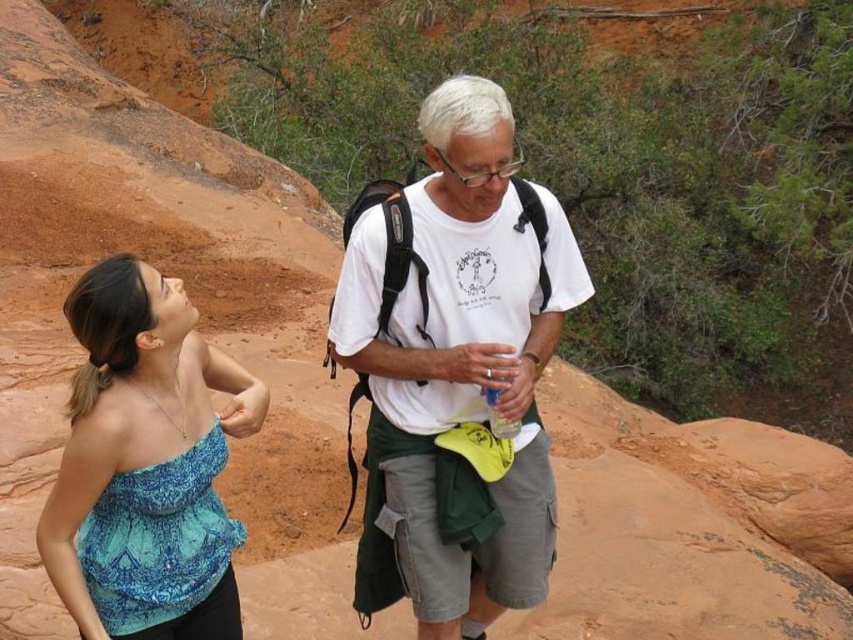
Based on the photo, you are taking a photo of two people standing in a natural setting. You notice two points in the image at coordinates point (430, 404) and point (376, 413). Which point is closer to the camera?

Point (430, 404) is closer to the camera than point (376, 413).

You are standing in the scene and want to move from the point closer to you to the farther point. Which path should you take, going towards the point at (x=469, y=550) or the point at (x=164, y=412)?

You should go towards the point at (x=164, y=412) because it is farther away from you, while the point at (x=469, y=550) is closer. Since you want to move to the farther point, the correct path is towards (x=164, y=412).

Looking at this image, you are taking a photo of the two people in the scene. You want to focus on the person closer to the camera. Which point should you use for auto focus? Choose between point (70, 326) and point (164, 513).

Point (70, 326) is closer to the camera than point (164, 513), so you should use point (70, 326) for auto focus.